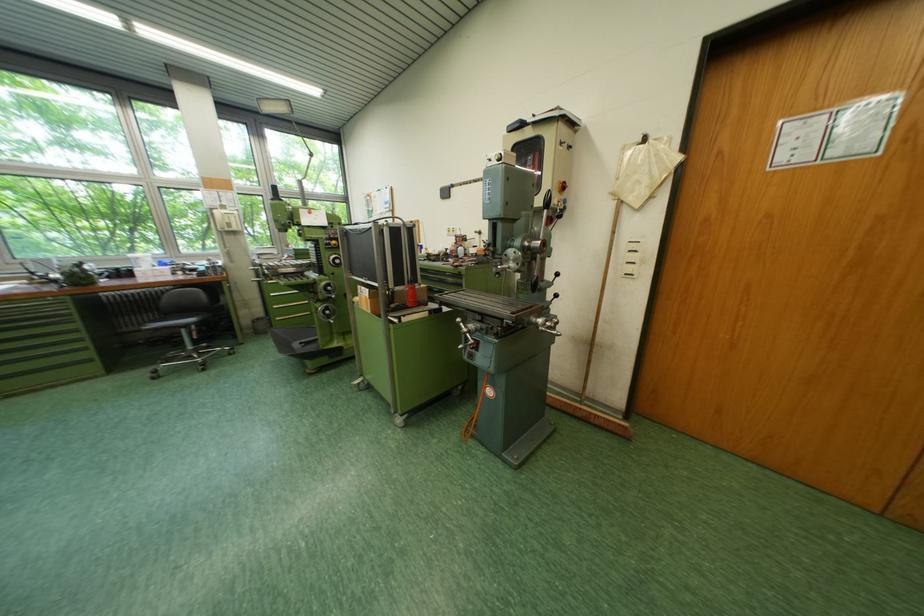
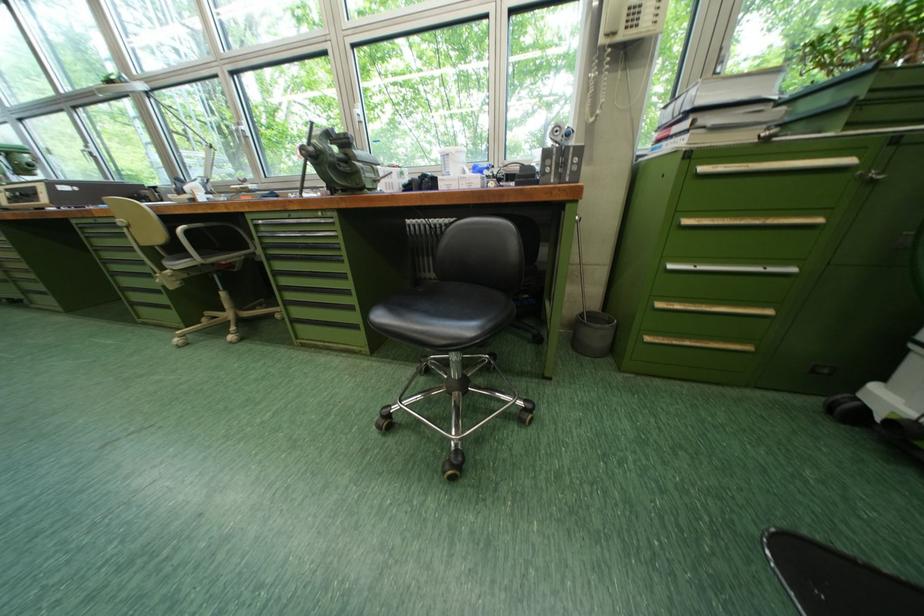
Where in the second image is the point corresponding to the point at 287,321 from the first image?

(659, 341)